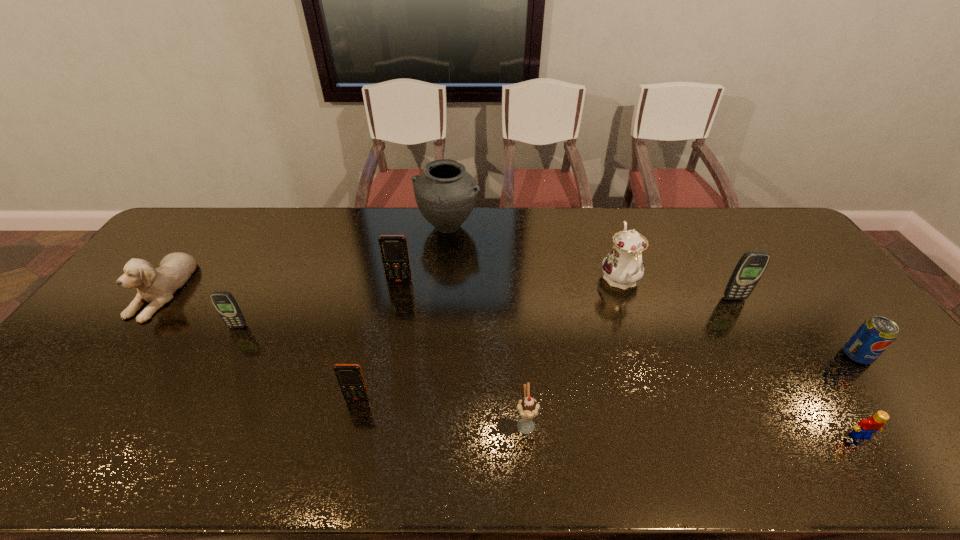
Where is `Lego that is at the near edge`? The width and height of the screenshot is (960, 540). Lego that is at the near edge is located at coordinates (866, 427).

At what (x,y) coordinates should I click in order to perform the action: click on object that is at the left edge. Please return your answer as a coordinate pair (x, y). Looking at the image, I should click on (156, 286).

Find the location of `object that is at the right edge`. object that is at the right edge is located at coordinates (875, 335).

The width and height of the screenshot is (960, 540). I want to click on free space at the far edge of the desktop, so click(357, 222).

Identify the location of blank space at the near edge of the desktop. (291, 454).

At what (x,y) coordinates should I click in order to perform the action: click on vacant space at the left edge of the desktop. Please return your answer as a coordinate pair (x, y). The width and height of the screenshot is (960, 540). Looking at the image, I should click on (148, 332).

The height and width of the screenshot is (540, 960). Identify the location of free space at the right edge. (800, 272).

This screenshot has height=540, width=960. In the image, there is a desktop. In order to click on vacant area at the far left corner in this screenshot , I will do `click(187, 239)`.

I want to click on free space between the third nearest object and the black urn, so click(x=402, y=313).

Identify the location of unoccupied area between the nearest cellular telephone and the Lego. The image size is (960, 540). (609, 417).